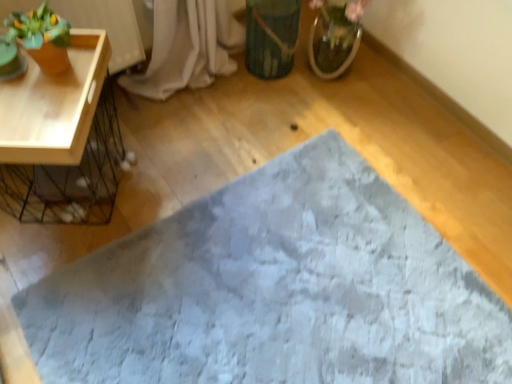
In order to click on green matte vase at center in this screenshot , I will do `click(271, 36)`.

I want to click on green matte vase at center, so click(x=271, y=36).

Can you confirm if gray textured bath mat at center is taller than matte orange pot at upper left?

No.

How different are the orientations of gray textured bath mat at center and matte orange pot at upper left in degrees?

gray textured bath mat at center and matte orange pot at upper left are facing 90 degrees away from each other.

In the scene shown: Are gray textured bath mat at center and matte orange pot at upper left located far from each other?

Actually, gray textured bath mat at center and matte orange pot at upper left are a little close together.

Find the location of `houseplant lying behind the gray textured bath mat at center`. houseplant lying behind the gray textured bath mat at center is located at coordinates (42, 37).

Would you say green matte vase at center is part of matte orange pot at upper left's contents?

Actually, green matte vase at center is outside matte orange pot at upper left.

Does point (58, 29) come in front of point (250, 24)?

That is True.

Is matte orange pot at upper left shorter than green matte vase at center?

Correct, matte orange pot at upper left is not as tall as green matte vase at center.

Is green matte vase at center oriented away from matte orange pot at upper left?

That's not correct — green matte vase at center is not looking away from matte orange pot at upper left.

Locate an element on the screen. houseplant below the green matte vase at center (from the image's perspective) is located at coordinates (42, 37).

Is green matte vase at center far away from matte orange pot at upper left?

They are positioned close to each other.

Between green matte vase at center and matte orange pot at upper left, which one has larger width?

With larger width is green matte vase at center.

Which is behind, point (270, 8) or point (508, 309)?

The point (270, 8) is more distant.

Between green matte vase at center and gray textured bath mat at center, which one appears on the left side from the viewer's perspective?

gray textured bath mat at center is more to the left.

How far apart are green matte vase at center and gray textured bath mat at center?

green matte vase at center and gray textured bath mat at center are 84.18 centimeters apart from each other.

Is gray textured bath mat at center surrounded by green matte vase at center?

No, gray textured bath mat at center is not a part of green matte vase at center.

Which is less distant, (232, 339) or (249, 20)?

The point (232, 339) is more forward.

Locate an element on the screen. flowerpot above the gray textured bath mat at center (from the image's perspective) is located at coordinates (271, 36).

Would you consider gray textured bath mat at center to be distant from green matte vase at center?

No, gray textured bath mat at center is in close proximity to green matte vase at center.

Can you confirm if gray textured bath mat at center is thinner than green matte vase at center?

No.

Is gray textured bath mat at center a part of matte orange pot at upper left?

No, gray textured bath mat at center is not a part of matte orange pot at upper left.

Is matte orange pot at upper left thinner than gray textured bath mat at center?

Indeed, matte orange pot at upper left has a lesser width compared to gray textured bath mat at center.

From the image's perspective, between matte orange pot at upper left and gray textured bath mat at center, which one is located above?

matte orange pot at upper left.

Does matte orange pot at upper left turn towards gray textured bath mat at center?

No, matte orange pot at upper left is not facing towards gray textured bath mat at center.

At what (x,y) coordinates should I click in order to perform the action: click on houseplant located behind the gray textured bath mat at center. Please return your answer as a coordinate pair (x, y). The height and width of the screenshot is (384, 512). Looking at the image, I should click on (42, 37).

This screenshot has width=512, height=384. Find the location of `houseplant above the green matte vase at center (from a real-world perspective)`. houseplant above the green matte vase at center (from a real-world perspective) is located at coordinates (42, 37).

Looking at the image, which one is located closer to matte orange pot at upper left, gray textured bath mat at center or green matte vase at center?

green matte vase at center lies closer to matte orange pot at upper left than the other object.

Which object lies nearer to the anchor point gray textured bath mat at center, green matte vase at center or matte orange pot at upper left?

green matte vase at center.

Considering their positions, is gray textured bath mat at center positioned closer to green matte vase at center than matte orange pot at upper left?

matte orange pot at upper left is positioned closer to the anchor green matte vase at center.

Estimate the real-world distances between objects in this image. Which object is further from matte orange pot at upper left, green matte vase at center or gray textured bath mat at center?

gray textured bath mat at center.

Based on their spatial positions, is matte orange pot at upper left or green matte vase at center further from gray textured bath mat at center?

Among the two, matte orange pot at upper left is located further to gray textured bath mat at center.

Considering their positions, is matte orange pot at upper left positioned closer to green matte vase at center than gray textured bath mat at center?

matte orange pot at upper left is closer to green matte vase at center.

Find the location of `houseplant between green matte vase at center and gray textured bath mat at center from top to bottom`. houseplant between green matte vase at center and gray textured bath mat at center from top to bottom is located at coordinates (42, 37).